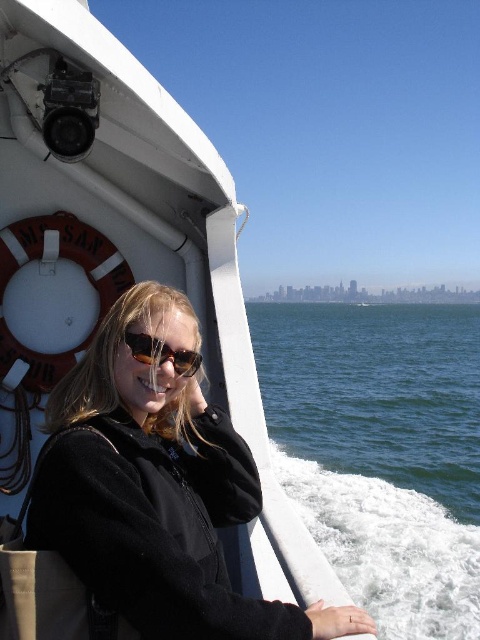
Question: Which point is closer to the camera?

Choices:
 (A) matte black sunglasses at center
 (B) blue water at lower right

Answer: (A)

Question: Which of the following is the farthest from the observer?

Choices:
 (A) blue water at lower right
 (B) matte black sunglasses at center

Answer: (A)

Question: Where is blue water at lower right located in relation to matte black sunglasses at center in the image?

Choices:
 (A) right
 (B) left

Answer: (A)

Question: Which of the following is the closest to the observer?

Choices:
 (A) matte black sunglasses at center
 (B) blue water at lower right

Answer: (A)

Question: In this image, where is blue water at lower right located relative to matte black sunglasses at center?

Choices:
 (A) left
 (B) right

Answer: (B)

Question: Does blue water at lower right appear under matte black sunglasses at center?

Choices:
 (A) yes
 (B) no

Answer: (A)